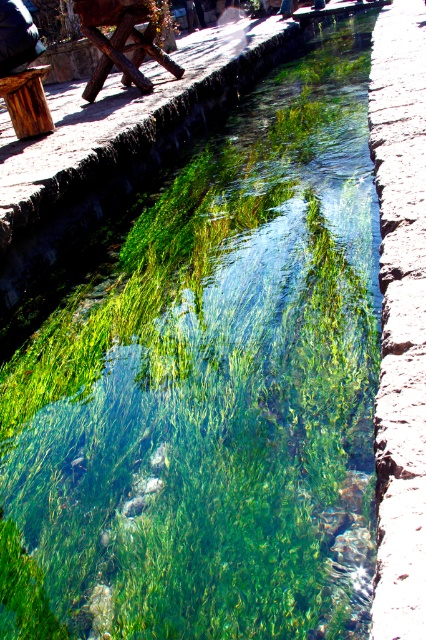
Can you confirm if wooden picnic table at upper left is thinner than wooden stool at upper left?

No, wooden picnic table at upper left is not thinner than wooden stool at upper left.

Between point (89, 3) and point (17, 74), which one is positioned behind?

The point (89, 3) is behind.

Locate an element on the screen. The width and height of the screenshot is (426, 640). wooden picnic table at upper left is located at coordinates (120, 42).